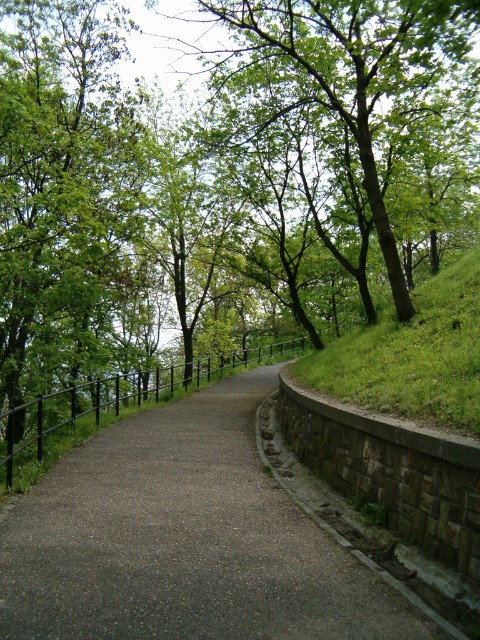
You are standing on the paved pathway and want to walk towards the point labeled point (439,140) and point (63,412). Which point will you reach first?

You will reach point (63,412) first because it is closer to you than point (439,140), which is further away.

You are a hiker who wants to know if the dark gray asphalt road at center is taller than the black metal fence at center. Based on the scene, can you tell me which one is taller?

The dark gray asphalt road at center is not as tall as the black metal fence at center, so the black metal fence at center is taller.